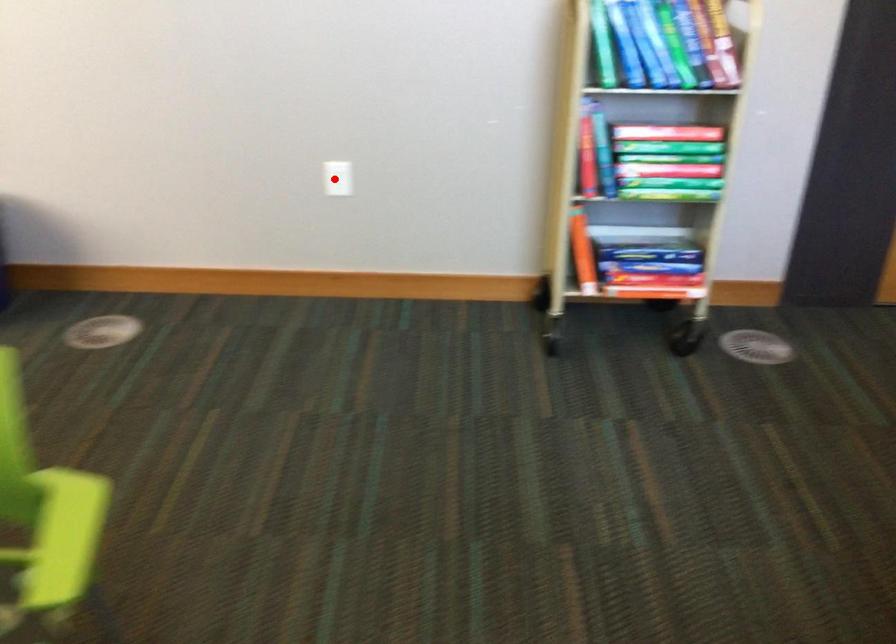
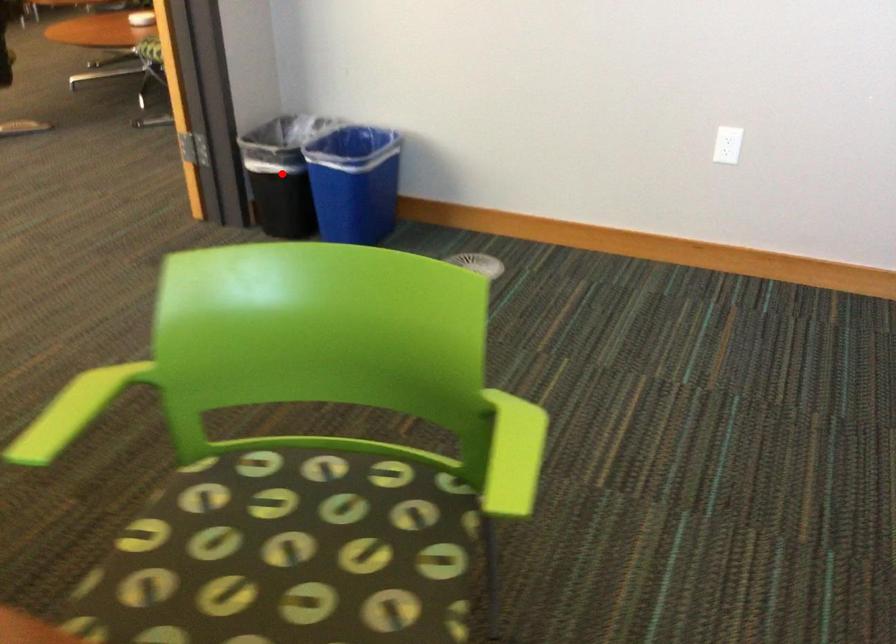
Based on the photo, I am providing you with two images of the same scene from different viewpoints. A red point is marked on the first image and another point is marked on the second image. Are the points marked in image1 and image2 representing the same 3D position?

No